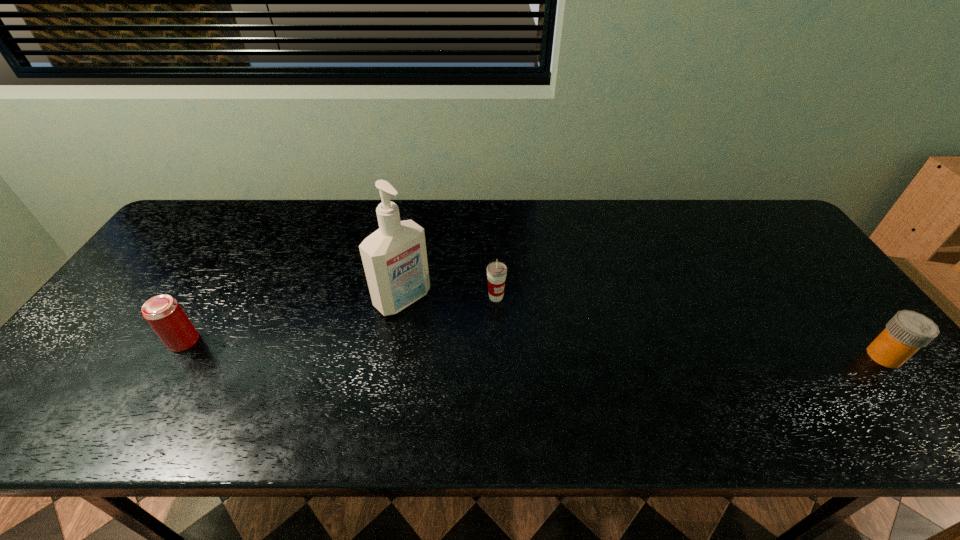
I want to click on object that is the third closest to the cup, so click(907, 331).

At what (x,y) coordinates should I click in order to perform the action: click on free space that satisfies the following two spatial constraints: 1. on the front side of the rightmost object; 2. on the label side of the cup. Please return your answer as a coordinate pair (x, y). Looking at the image, I should click on click(x=498, y=356).

Image resolution: width=960 pixels, height=540 pixels. I want to click on free region that satisfies the following two spatial constraints: 1. on the back side of the leftmost object; 2. on the left side of the cup, so click(x=210, y=297).